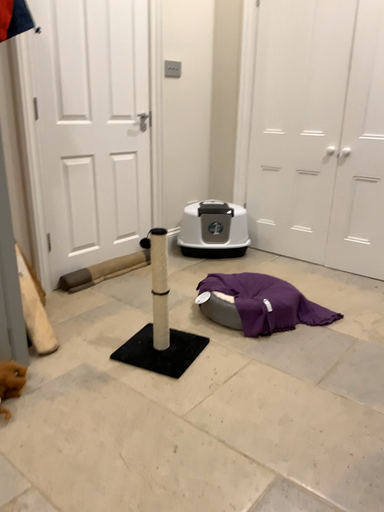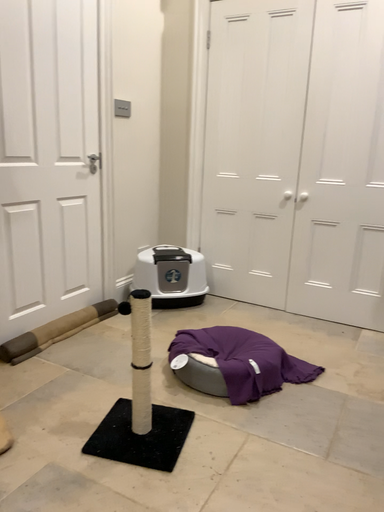
Question: Which way did the camera rotate in the video?

Choices:
 (A) rotated right
 (B) rotated left

Answer: (A)